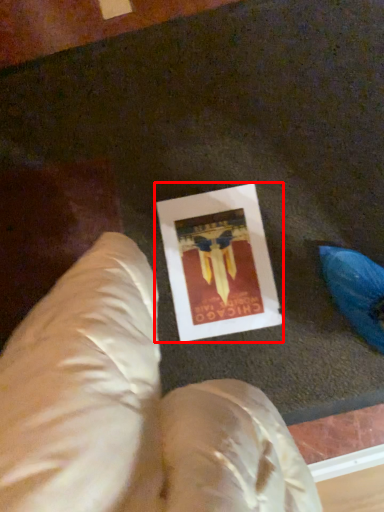
Question: From the image's perspective, where is picture frame (annotated by the red box) located in relation to bean bag chair in the image?

Choices:
 (A) above
 (B) below

Answer: (A)